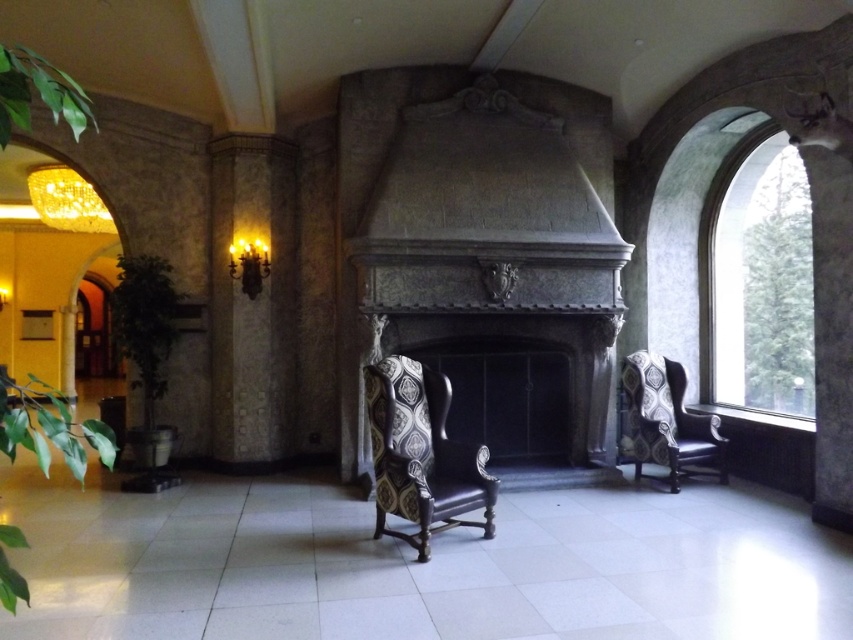
You are standing in the room and want to place a small decorative item exactly halfway between point (436, 490) and point (642, 420). Given that the camera is positioned at the entrance, will the decorative item be closer to the camera or further away from it compared to the two points?

The decorative item placed halfway between point (436, 490) and point (642, 420) will be closer to the camera than point (642, 420) but farther than point (436, 490). Since the average distance would be between the two, it won???t be closer to the camera than both points.

You are an interior designer assessing the space. You need to place a tall floor lamp that requires at least 2 meters of vertical clearance. Based on the scene, can the lamp be placed near the dark stone fireplace at center without obstructing the patterned fabric wingback chair at right?

The dark stone fireplace at center is much taller than the patterned fabric wingback chair at right, so placing the tall floor lamp near the fireplace would be feasible as long as there is enough vertical space above the fireplace itself. However, ensure the lamp doesn

You are standing in the center of the room. There is a clear glass window at right located at point [761,284]. Can you see the fireplace through the clear glass window at right?

The clear glass window at right at point [761,284] is positioned to the right side of the room. Since the fireplace is the focal point in the center facing the wingback chairs, the window is likely located outside the line of sight from the center towards the fireplace. Therefore, you cannot see the fireplace through the clear glass window at right.